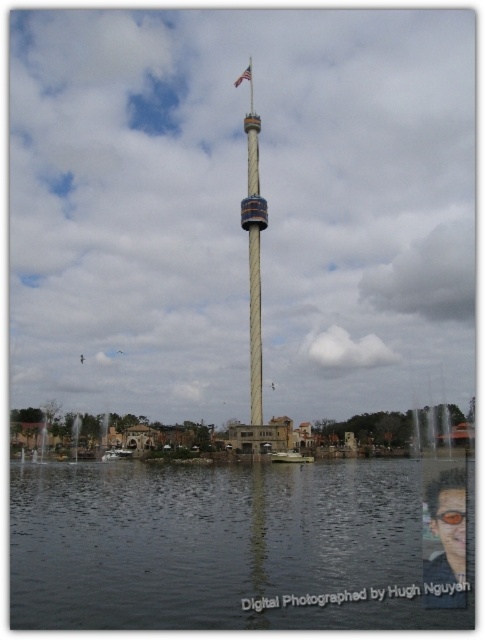
You are standing at the base of the tower and notice both the orange plastic goggles at center and the metallic flag pole at center. Which object is shorter?

The orange plastic goggles at center is shorter than the metallic flag pole at center.

You are standing at the base of the metallic flag pole at center and want to walk to the smooth beige tower at center. In which direction should you move?

You should move to your right to reach the smooth beige tower at center, as it is located to the right of the metallic flag pole at center.

You are a photographer trying to capture the metallic flag pole at center in your shot. You notice the shiny black sunglasses at lower right might be partially blocking the view. Can you confirm if the sunglasses are wider than the flag pole?

The shiny black sunglasses at lower right might be wider than metallic flag pole at center, so there is a possibility that the sunglasses could block the view of the flag pole depending on their actual widths.